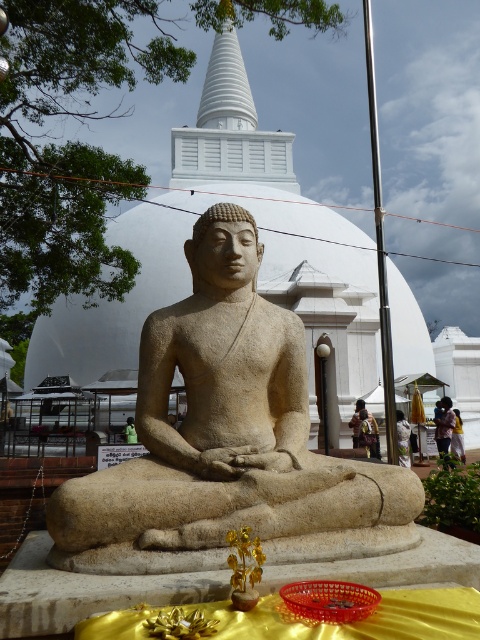
Which is in front, point (235, 76) or point (452, 412)?

Positioned in front is point (452, 412).

Is white stupa at upper center below yellow fabric at lower center?

No.

Does point (245, 81) come in front of point (453, 417)?

No, (245, 81) is behind (453, 417).

Find the location of a particular element. Image resolution: width=480 pixels, height=640 pixels. white stupa at upper center is located at coordinates (226, 86).

Does yellow fabric at lower center appear over light brown fabric at lower right?

Indeed, yellow fabric at lower center is positioned over light brown fabric at lower right.

Is point (443, 408) farther from viewer compared to point (453, 428)?

Yes.

Is point (439, 444) positioned behind point (451, 449)?

No, (439, 444) is in front of (451, 449).

What are the coordinates of `yellow fabric at lower center` in the screenshot? It's located at (444, 426).

Does beige stone statue at center appear on the left side of light brown fabric at lower right?

Indeed, beige stone statue at center is positioned on the left side of light brown fabric at lower right.

Which is behind, point (169, 337) or point (462, 442)?

The point (462, 442) is more distant.

Locate an element on the screen. beige stone statue at center is located at coordinates (227, 440).